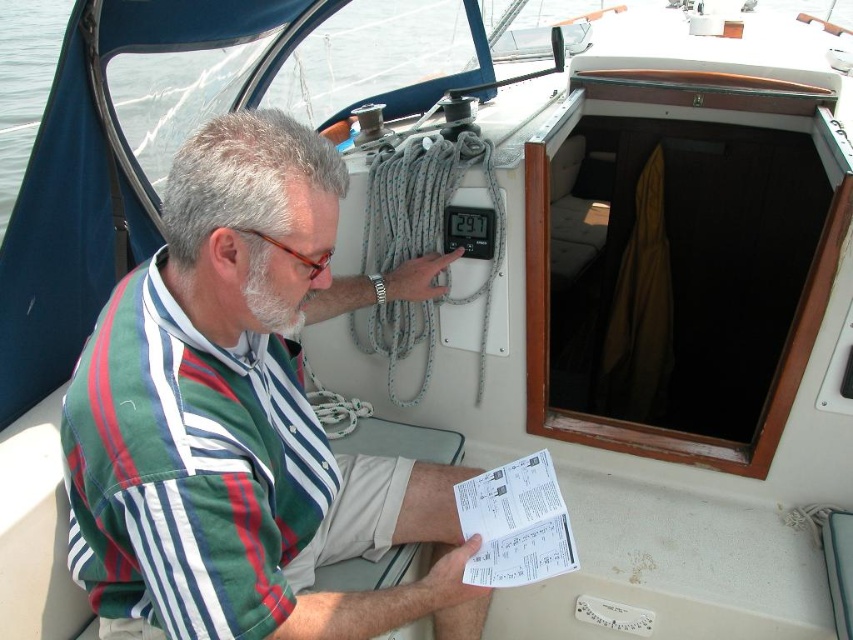
You are a sailor on the boat and need to determine which of the two points, point (155, 577) or point (554, 557), is closer to you. Which one should you choose?

Point (155, 577) is closer to the viewer than point (554, 557), so you should choose point (155, 577).

You are on a boat and need to locate the green striped shirt at center and the white paper at lower center. According to the scene, which object is positioned to the left?

The green striped shirt at center is to the left of the white paper at lower center.

You are a sailor trying to determine if your green striped shirt at center can be folded and stored in the compartment designed for the white paper at lower center. Based on their sizes, will it fit?

The green striped shirt at center is wider than the white paper at lower center, so it may not fit properly in the compartment designed for the white paper at lower center.